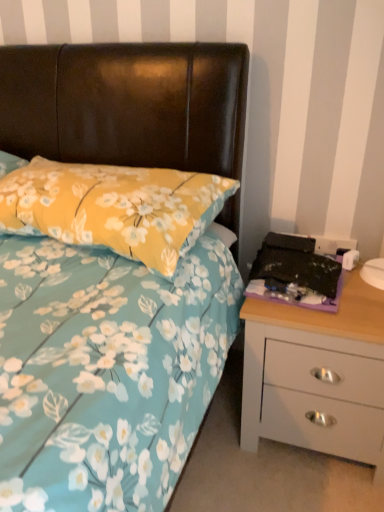
This screenshot has height=512, width=384. What do you see at coordinates (114, 207) in the screenshot?
I see `yellow floral pillow at upper left` at bounding box center [114, 207].

You are a GUI agent. You are given a task and a screenshot of the screen. Output one action in this format:
    pyautogui.click(x=<x>, y=<y>)
    Task: Click on the yellow floral pillow at upper left
    Image resolution: width=384 pixels, height=512 pixels.
    Given the screenshot: What is the action you would take?
    pyautogui.click(x=114, y=207)

Measure the distance between point [128,185] and camera.

They are 1.05 meters apart.

Image resolution: width=384 pixels, height=512 pixels. I want to click on white matte chest of drawers at right, so click(318, 375).

Image resolution: width=384 pixels, height=512 pixels. Describe the element at coordinates (318, 375) in the screenshot. I see `white matte chest of drawers at right` at that location.

You are a GUI agent. You are given a task and a screenshot of the screen. Output one action in this format:
    pyautogui.click(x=<x>, y=<y>)
    Task: Click on the yellow floral pillow at upper left
    This screenshot has width=384, height=512.
    Given the screenshot: What is the action you would take?
    pyautogui.click(x=114, y=207)

Considering the relative positions of white matte chest of drawers at right and yellow floral pillow at upper left in the image provided, is white matte chest of drawers at right to the left or to the right of yellow floral pillow at upper left?

white matte chest of drawers at right is positioned on yellow floral pillow at upper left's right side.

Is white matte chest of drawers at right in front of or behind yellow floral pillow at upper left in the image?

In the image, white matte chest of drawers at right appears behind yellow floral pillow at upper left.

Is point (296, 418) closer or farther from the camera than point (7, 195)?

Point (296, 418) is farther from the camera than point (7, 195).

In the scene shown: From the image's perspective, is white matte chest of drawers at right above or below yellow floral pillow at upper left?

Based on their image positions, white matte chest of drawers at right is located beneath yellow floral pillow at upper left.

Based on the photo, from a real-world perspective, which object rests below the other?

In real-world perspective, white matte chest of drawers at right is lower.

Between white matte chest of drawers at right and yellow floral pillow at upper left, which one has larger width?

Wider between the two is yellow floral pillow at upper left.

Considering the sizes of objects white matte chest of drawers at right and yellow floral pillow at upper left in the image provided, who is taller, white matte chest of drawers at right or yellow floral pillow at upper left?

Standing taller between the two is white matte chest of drawers at right.

Considering the sizes of objects white matte chest of drawers at right and yellow floral pillow at upper left in the image provided, who is bigger, white matte chest of drawers at right or yellow floral pillow at upper left?

white matte chest of drawers at right is bigger.

Does white matte chest of drawers at right contain yellow floral pillow at upper left?

That's incorrect, yellow floral pillow at upper left is not inside white matte chest of drawers at right.

Is there a large distance between white matte chest of drawers at right and yellow floral pillow at upper left?

They are positioned close to each other.

Is white matte chest of drawers at right facing away from yellow floral pillow at upper left?

No.

How far apart are white matte chest of drawers at right and yellow floral pillow at upper left?

white matte chest of drawers at right is 18.53 inches from yellow floral pillow at upper left.

I want to click on pillow in front of the white matte chest of drawers at right, so click(114, 207).

Considering the positions of objects yellow floral pillow at upper left and white matte chest of drawers at right in the image provided, who is more to the right, yellow floral pillow at upper left or white matte chest of drawers at right?

white matte chest of drawers at right is more to the right.

Relative to white matte chest of drawers at right, is yellow floral pillow at upper left in front or behind?

In the image, yellow floral pillow at upper left appears in front of white matte chest of drawers at right.

Considering the points (109, 236) and (330, 399), which point is behind, point (109, 236) or point (330, 399)?

The point (330, 399) is behind.

From the image's perspective, does yellow floral pillow at upper left appear higher than white matte chest of drawers at right?

Yes, from the image's perspective, yellow floral pillow at upper left is above white matte chest of drawers at right.

From a real-world perspective, is yellow floral pillow at upper left positioned above or below white matte chest of drawers at right?

yellow floral pillow at upper left is above white matte chest of drawers at right.

Is yellow floral pillow at upper left wider than white matte chest of drawers at right?

Yes, yellow floral pillow at upper left is wider than white matte chest of drawers at right.

Consider the image. Does yellow floral pillow at upper left have a greater height compared to white matte chest of drawers at right?

No.

Looking at the image, does yellow floral pillow at upper left seem bigger or smaller compared to white matte chest of drawers at right?

yellow floral pillow at upper left is smaller than white matte chest of drawers at right.

Is yellow floral pillow at upper left outside of white matte chest of drawers at right?

Yes.

Is yellow floral pillow at upper left touching white matte chest of drawers at right?

No, yellow floral pillow at upper left is not in contact with white matte chest of drawers at right.

Is yellow floral pillow at upper left oriented away from white matte chest of drawers at right?

That's not correct — yellow floral pillow at upper left is not looking away from white matte chest of drawers at right.

How different are the orientations of yellow floral pillow at upper left and white matte chest of drawers at right in degrees?

They differ by 1.38 degrees in their facing directions.

This screenshot has width=384, height=512. Identify the location of chest of drawers on the right of yellow floral pillow at upper left. (318, 375).

What are the coordinates of `pillow on the left of white matte chest of drawers at right` in the screenshot? It's located at coord(114,207).

At what (x,y) coordinates should I click in order to perform the action: click on the chest of drawers that appears below the yellow floral pillow at upper left (from a real-world perspective). Please return your answer as a coordinate pair (x, y). Looking at the image, I should click on (318, 375).